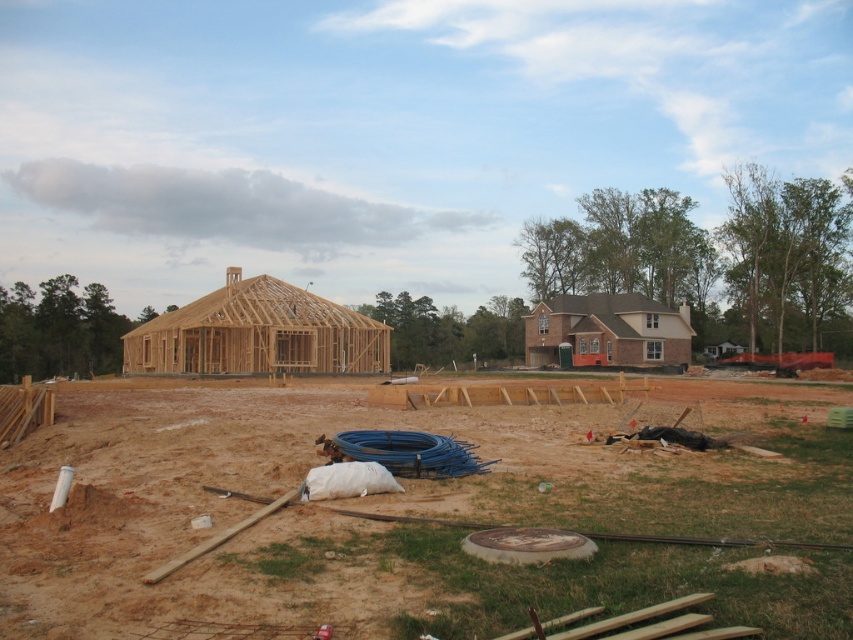
Does wooden frame house at center appear on the left side of brown brick house at center-right?

Yes, wooden frame house at center is to the left of brown brick house at center-right.

Between wooden frame house at center and brown brick house at center-right, which one has less height?

brown brick house at center-right

Consider the image. Who is more forward, (x=149, y=337) or (x=631, y=296)?

Point (x=149, y=337)

This screenshot has width=853, height=640. What are the coordinates of `wooden frame house at center` in the screenshot? It's located at (257, 333).

Measure the distance from brown wooden construction site at center to wooden frame house at center.

The distance of brown wooden construction site at center from wooden frame house at center is 94.49 feet.

Measure the distance between brown wooden construction site at center and camera.

A distance of 4.74 meters exists between brown wooden construction site at center and camera.

The width and height of the screenshot is (853, 640). What are the coordinates of `brown wooden construction site at center` in the screenshot? It's located at (405, 515).

Which is behind, point (448, 612) or point (587, 305)?

Positioned behind is point (587, 305).

Can you confirm if brown wooden construction site at center is positioned to the left of brown brick house at center-right?

Yes, brown wooden construction site at center is to the left of brown brick house at center-right.

Locate an element on the screen. The width and height of the screenshot is (853, 640). brown wooden construction site at center is located at coordinates (405, 515).

I want to click on brown wooden construction site at center, so click(x=405, y=515).